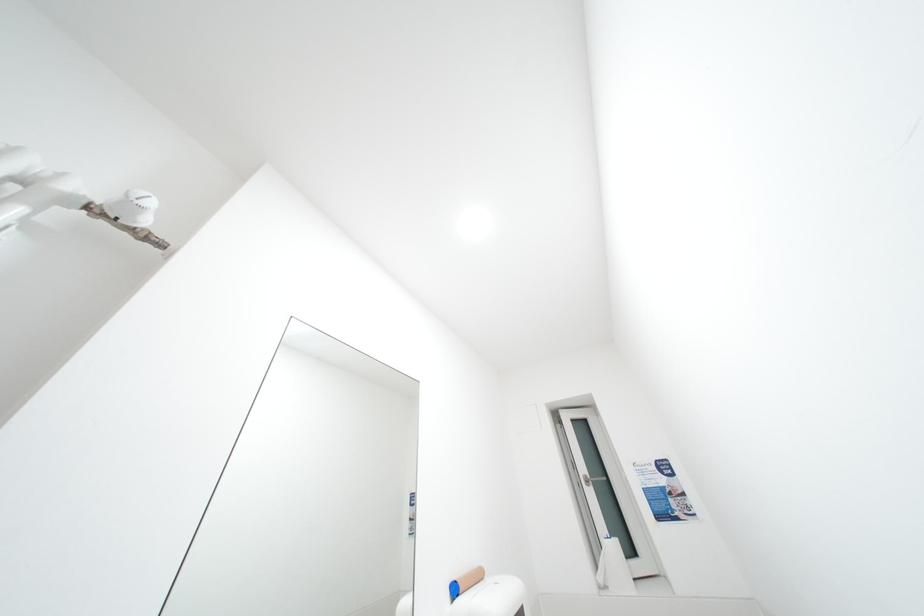
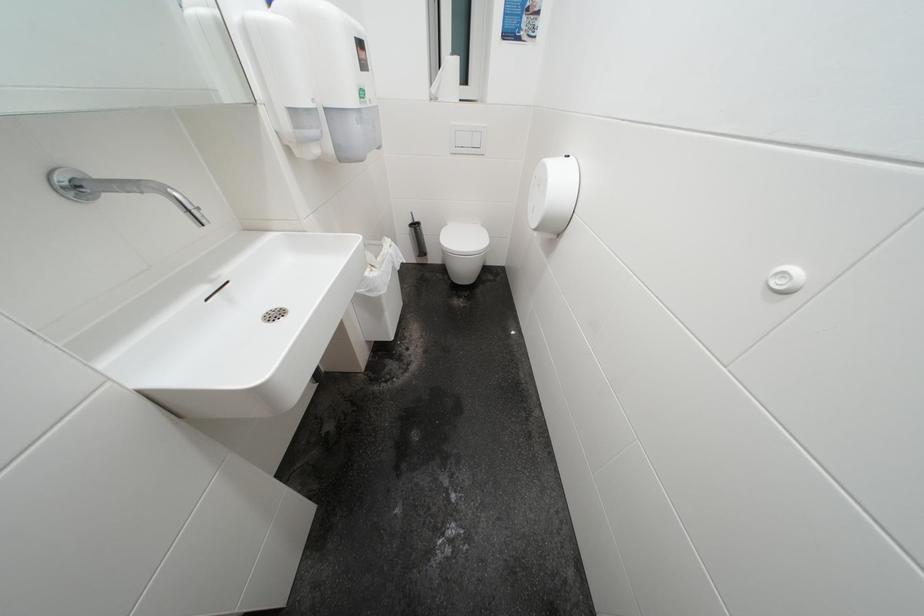
How did the camera likely rotate?

The camera rotated toward right-down.